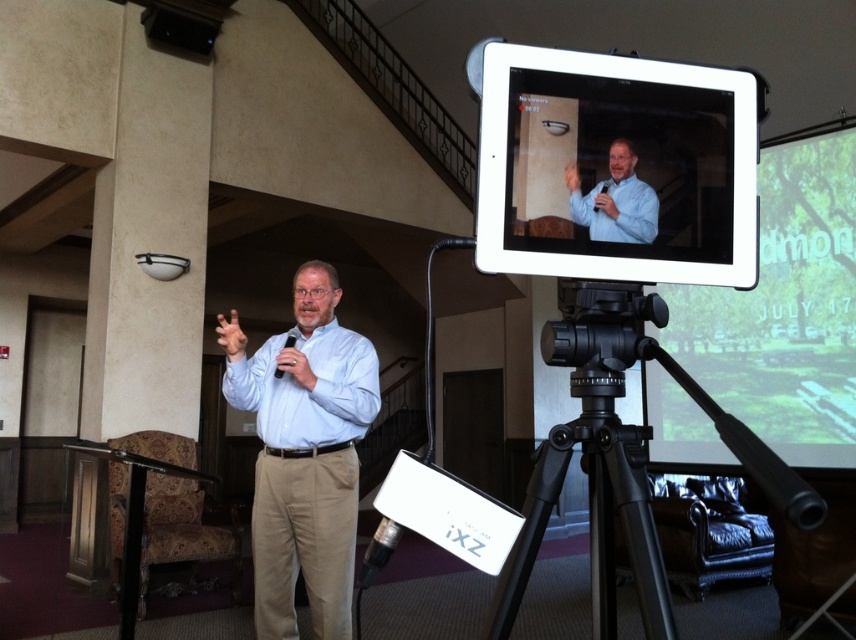
Question: Estimate the real-world distances between objects in this image. Which object is farther from the black matte tripod at center?

Choices:
 (A) matte black tablet at upper right
 (B) blue shirt at upper center

Answer: (B)

Question: Does matte white projector screen at upper right appear on the right side of black matte tripod at center?

Choices:
 (A) yes
 (B) no

Answer: (A)

Question: Estimate the real-world distances between objects in this image. Which object is farther from the matte white projector screen at upper right?

Choices:
 (A) light blue shirt at center
 (B) black matte tripod at center
 (C) white matte dress shirt at center
 (D) blue shirt at upper center

Answer: (D)

Question: Is matte black tablet at upper right positioned behind light blue shirt at center?

Choices:
 (A) yes
 (B) no

Answer: (B)

Question: Observing the image, what is the correct spatial positioning of matte black tablet at upper right in reference to black matte tripod at center?

Choices:
 (A) below
 (B) above

Answer: (B)

Question: Which object is the farthest from the white matte dress shirt at center?

Choices:
 (A) black matte tripod at center
 (B) light blue shirt at center
 (C) blue shirt at upper center

Answer: (C)